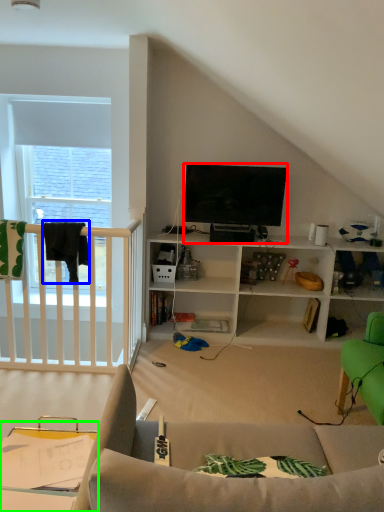
Question: Which is farther away from television (highlighted by a red box)? clothesline (highlighted by a blue box) or table (highlighted by a green box)?

Choices:
 (A) clothesline
 (B) table

Answer: (B)